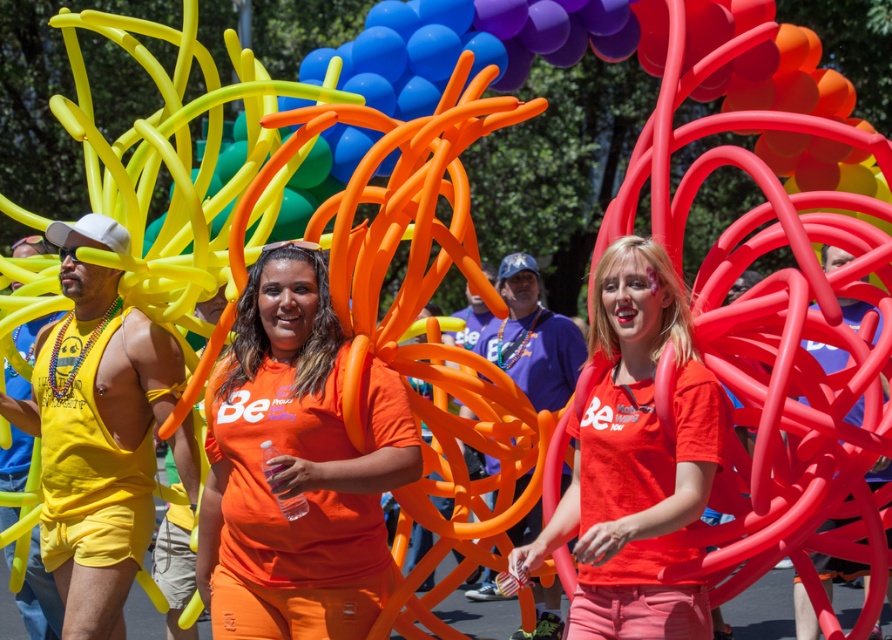
You are a photographer at the event and want to capture both the orange matte shirt at center and the matte orange shirt at center in a single photo. Which one should you focus on first to ensure both are in frame?

The orange matte shirt at center is below the matte orange shirt at center, so you should focus on the matte orange shirt at center first to ensure both are in frame.

You are organizing a photo shoot and need to place two models wearing the orange matte shirt at center and the matte yellow tank top at left. Given their sizes, which model should stand closer to the camera to ensure both appear proportionate in the final image?

The orange matte shirt at center is smaller than the matte yellow tank top at left, so the model wearing the orange matte shirt at center should stand closer to the camera to appear proportionate in size to the matte yellow tank top at left.

You are a photographer at the event and want to capture both the orange matte shirt at center and the matte yellow tank top at left in a single shot. However, your camera has a limited depth of field. Which subject should you focus on to ensure both are in focus?

The orange matte shirt at center is in front of the matte yellow tank top at left, so focusing on the orange matte shirt at center will ensure both are in focus as it is closer to the camera.